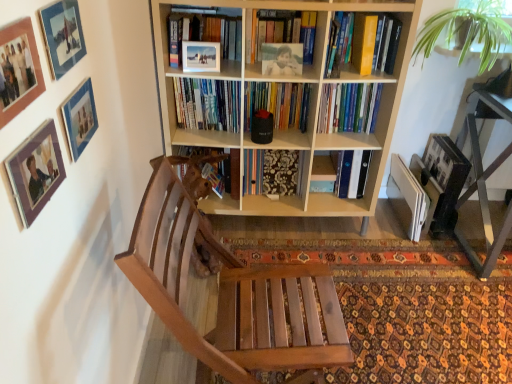
Question: Relative to yellow hardcover book at upper right, arranged as the first book when viewed from the top, is hardcover books at center, the 1th book in the bottom-to-top sequence, in front or behind?

Choices:
 (A) behind
 (B) front

Answer: (A)

Question: Visually, is hardcover books at center, the 1th book in the bottom-to-top sequence, positioned to the left or to the right of yellow hardcover book at upper right, the second book positioned from the bottom?

Choices:
 (A) left
 (B) right

Answer: (A)

Question: Considering the real-world distances, which object is farthest from the light wood bookcase at center?

Choices:
 (A) yellow hardcover book at upper right, arranged as the first book when viewed from the top
 (B) metallic black table at right
 (C) matte wooden picture frame at upper left, which is the 2th picture frame in top-to-bottom order
 (D) wooden chair at center
 (E) green leafy plant at upper right

Answer: (C)

Question: Which object is positioned closest to the green leafy plant at upper right?

Choices:
 (A) hardcover books at center, the second book when ordered from top to bottom
 (B) wooden chair at center
 (C) matte glass picture frame at upper left, arranged as the 4th picture frame when ordered from the bottom
 (D) wooden picture frame at upper left, marked as the 4th picture frame in a top-to-bottom arrangement
 (E) matte wooden picture frame at upper left, which is the third picture frame in bottom-to-top order

Answer: (A)